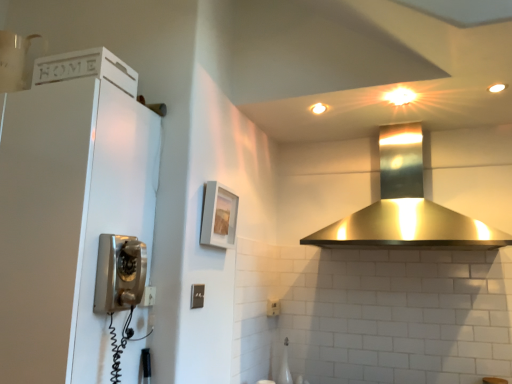
Question: From the image's perspective, is matte gray picture frame at center located beneath white matte cabinet at left?

Choices:
 (A) yes
 (B) no

Answer: (B)

Question: Considering the relative sizes of matte gray picture frame at center and white matte cabinet at left in the image provided, is matte gray picture frame at center shorter than white matte cabinet at left?

Choices:
 (A) yes
 (B) no

Answer: (A)

Question: Considering the relative sizes of matte gray picture frame at center and white matte cabinet at left in the image provided, is matte gray picture frame at center bigger than white matte cabinet at left?

Choices:
 (A) yes
 (B) no

Answer: (B)

Question: Is matte gray picture frame at center not close to white matte cabinet at left?

Choices:
 (A) no
 (B) yes

Answer: (A)

Question: Does matte gray picture frame at center lie behind white matte cabinet at left?

Choices:
 (A) yes
 (B) no

Answer: (A)

Question: From the image's perspective, relative to white matte cabinet at left, is matte gray picture frame at center above or below?

Choices:
 (A) below
 (B) above

Answer: (B)

Question: In the image, is matte gray picture frame at center positioned in front of or behind white matte cabinet at left?

Choices:
 (A) front
 (B) behind

Answer: (B)

Question: Is matte gray picture frame at center to the left or to the right of white matte cabinet at left in the image?

Choices:
 (A) right
 (B) left

Answer: (A)

Question: From a real-world perspective, is matte gray picture frame at center physically located above or below white matte cabinet at left?

Choices:
 (A) above
 (B) below

Answer: (A)

Question: Is point (328, 241) closer or farther from the camera than point (207, 230)?

Choices:
 (A) farther
 (B) closer

Answer: (A)

Question: In terms of height, does polished stainless steel range hood at upper center look taller or shorter compared to matte gray picture frame at center?

Choices:
 (A) tall
 (B) short

Answer: (A)

Question: In the image, is polished stainless steel range hood at upper center positioned in front of or behind matte gray picture frame at center?

Choices:
 (A) front
 (B) behind

Answer: (A)

Question: Do you think polished stainless steel range hood at upper center is within matte gray picture frame at center, or outside of it?

Choices:
 (A) inside
 (B) outside

Answer: (B)

Question: From a real-world perspective, is matte gray picture frame at center positioned above or below satin silver light switch at center?

Choices:
 (A) below
 (B) above

Answer: (B)

Question: Does point (211, 213) appear closer or farther from the camera than point (201, 292)?

Choices:
 (A) farther
 (B) closer

Answer: (A)